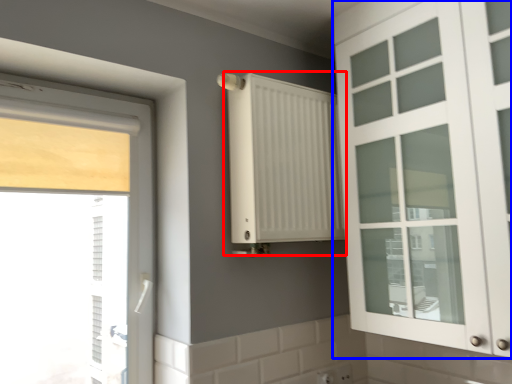
Question: Which point is further to the camera, radiator (highlighted by a red box) or cabinetry (highlighted by a blue box)?

Choices:
 (A) radiator
 (B) cabinetry

Answer: (A)